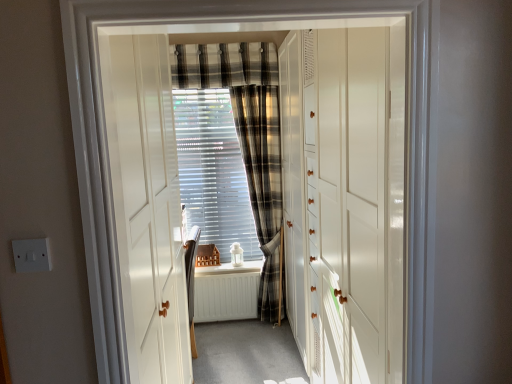
Question: In the image, is white glossy cabinet at center, which is the second door from front to back, positioned in front of or behind translucent plastic blinds at center?

Choices:
 (A) behind
 (B) front

Answer: (B)

Question: From a real-world perspective, is white glossy cabinet at center, which is the second door from front to back, physically located above or below translucent plastic blinds at center?

Choices:
 (A) below
 (B) above

Answer: (A)

Question: Estimate the real-world distances between objects in this image. Which object is closer to the plaid fabric curtain at center, positioned as the 1th curtain in bottom-to-top order?

Choices:
 (A) white painted wood at center
 (B) translucent plastic blinds at center
 (C) white plastic switch at lower left
 (D) plaid fabric curtain at upper center, which is the second curtain in bottom-to-top order
 (E) white matte radiator at center

Answer: (B)

Question: Which of these objects is positioned farthest from the white plastic switch at lower left?

Choices:
 (A) plaid fabric curtain at center, positioned as the 1th curtain in bottom-to-top order
 (B) white glossy door at center, placed as the 2th door when sorted from back to front
 (C) plaid fabric curtain at upper center, marked as the first curtain in a top-to-bottom arrangement
 (D) white painted wood at center
 (E) translucent plastic blinds at center

Answer: (E)